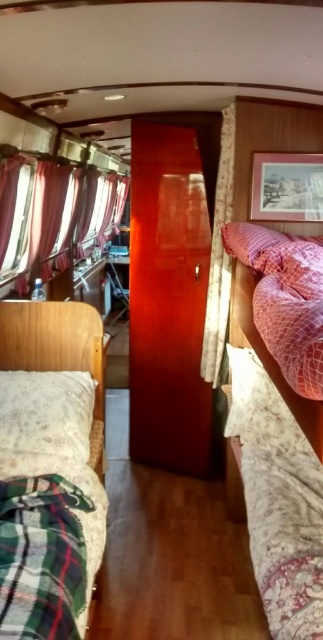
You are planning to sleep in the vintage train car and need to choose between the fluffy pink bed at center and the fluffy white bed at left. Which bed would you recommend for someone who prefers more space to stretch out?

The fluffy white bed at left has a greater width than the fluffy pink bed at center, so it would provide more space to stretch out.